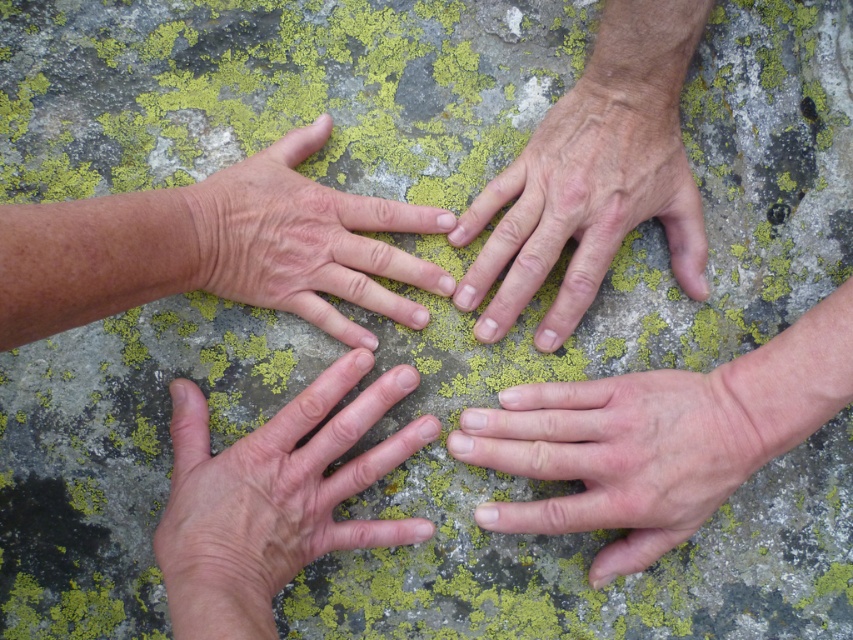
You are a photographer trying to capture the dry skin hand at lower left and the pale skin hand at lower right in focus. Since you can only focus on one plane, which hand should you focus on to ensure the other is also somewhat in focus?

You should focus on the dry skin hand at lower left because it is in front of the pale skin hand at lower right, so focusing on the closer object will keep the background one more in focus compared to focusing on the background one.

You are a photographer aiming to capture the hands on the rock. You need to ensure that both the dry skin hand at lower left and the dry skin hand at center are fully visible in the frame. Given their sizes, which hand might require you to adjust your camera angle to avoid cropping?

The dry skin hand at center is taller than the dry skin hand at lower left, so you might need to adjust the camera angle to ensure the taller dry skin hand at center is fully visible without being cropped.